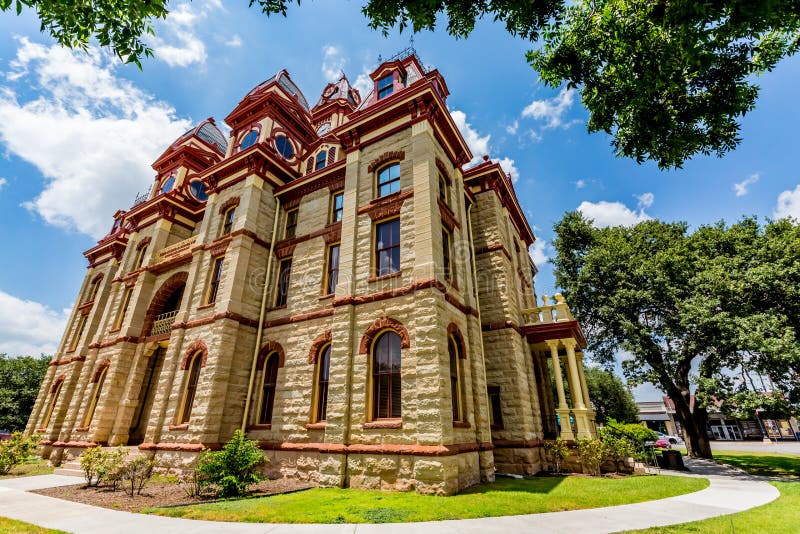
The width and height of the screenshot is (800, 534). I want to click on plant, so click(218, 468), click(129, 473), click(92, 465), click(18, 445), click(598, 444), click(629, 441).